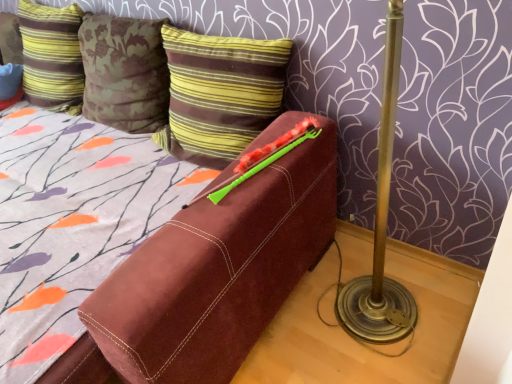
Question: Which direction should I rotate to look at brown striped pillow at upper center, which is the first pillow from right to left, — up or down?

Choices:
 (A) up
 (B) down

Answer: (A)

Question: Can you confirm if striped velvet pillow at upper left, which ranks as the 1th pillow in left-to-right order, is wider than green plastic crayon at upper center?

Choices:
 (A) yes
 (B) no

Answer: (B)

Question: Is striped velvet pillow at upper left, which is the second pillow from right to left, taller than green plastic crayon at upper center?

Choices:
 (A) yes
 (B) no

Answer: (A)

Question: Considering the relative sizes of striped velvet pillow at upper left, which is the second pillow from right to left, and green plastic crayon at upper center in the image provided, is striped velvet pillow at upper left, which is the second pillow from right to left, shorter than green plastic crayon at upper center?

Choices:
 (A) yes
 (B) no

Answer: (B)

Question: Can we say striped velvet pillow at upper left, which is the second pillow from right to left, lies outside green plastic crayon at upper center?

Choices:
 (A) yes
 (B) no

Answer: (A)

Question: Does striped velvet pillow at upper left, which ranks as the 1th pillow in left-to-right order, lie behind green plastic crayon at upper center?

Choices:
 (A) no
 (B) yes

Answer: (B)

Question: Is striped velvet pillow at upper left, which ranks as the 1th pillow in left-to-right order, oriented towards green plastic crayon at upper center?

Choices:
 (A) no
 (B) yes

Answer: (A)

Question: From the image's perspective, would you say striped velvet pillow at upper left, which ranks as the 1th pillow in left-to-right order, is shown under brown striped pillow at upper center, the second pillow in the left-to-right sequence?

Choices:
 (A) no
 (B) yes

Answer: (A)

Question: Is brown striped pillow at upper center, which is the first pillow from right to left, inside striped velvet pillow at upper left, which ranks as the 1th pillow in left-to-right order?

Choices:
 (A) yes
 (B) no

Answer: (B)

Question: Considering the relative positions of striped velvet pillow at upper left, which is the second pillow from right to left, and brown striped pillow at upper center, which is the first pillow from right to left, in the image provided, is striped velvet pillow at upper left, which is the second pillow from right to left, to the right of brown striped pillow at upper center, which is the first pillow from right to left, from the viewer's perspective?

Choices:
 (A) no
 (B) yes

Answer: (A)

Question: From the image's perspective, is striped velvet pillow at upper left, which ranks as the 1th pillow in left-to-right order, on top of brown striped pillow at upper center, the second pillow in the left-to-right sequence?

Choices:
 (A) no
 (B) yes

Answer: (B)

Question: Considering the relative sizes of striped velvet pillow at upper left, which ranks as the 1th pillow in left-to-right order, and brown striped pillow at upper center, the second pillow in the left-to-right sequence, in the image provided, is striped velvet pillow at upper left, which ranks as the 1th pillow in left-to-right order, shorter than brown striped pillow at upper center, the second pillow in the left-to-right sequence,?

Choices:
 (A) no
 (B) yes

Answer: (A)

Question: Is striped velvet pillow at upper left, which ranks as the 1th pillow in left-to-right order, taller than brown striped pillow at upper center, the second pillow in the left-to-right sequence?

Choices:
 (A) yes
 (B) no

Answer: (A)

Question: Considering the relative positions of green plastic crayon at upper center and striped velvet pillow at upper left, which ranks as the 1th pillow in left-to-right order, in the image provided, is green plastic crayon at upper center to the right of striped velvet pillow at upper left, which ranks as the 1th pillow in left-to-right order, from the viewer's perspective?

Choices:
 (A) no
 (B) yes

Answer: (B)